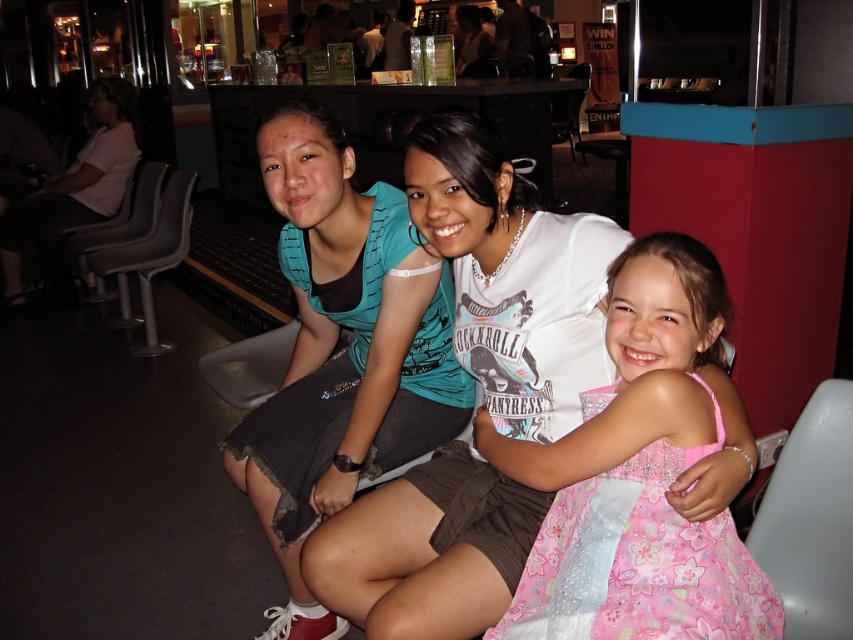
Question: Which point is closer to the camera?

Choices:
 (A) white plastic chair at lower right
 (B) white plastic chair at center

Answer: (A)

Question: Which of the following is the farthest from the observer?

Choices:
 (A) pink satin dress at center
 (B) teal fabric shirt at center
 (C) white plastic chair at center

Answer: (C)

Question: Which point is closer to the camera?

Choices:
 (A) (173, 221)
 (B) (96, 285)
 (C) (833, 547)
 (D) (125, 99)

Answer: (C)

Question: Is matte white shirt at upper left positioned in front of white plastic chair at center?

Choices:
 (A) yes
 (B) no

Answer: (B)

Question: Does pink satin dress at center lie behind white plastic chair at center?

Choices:
 (A) yes
 (B) no

Answer: (B)

Question: Is pink satin dress at center further to the viewer compared to white plastic chair at center?

Choices:
 (A) yes
 (B) no

Answer: (B)